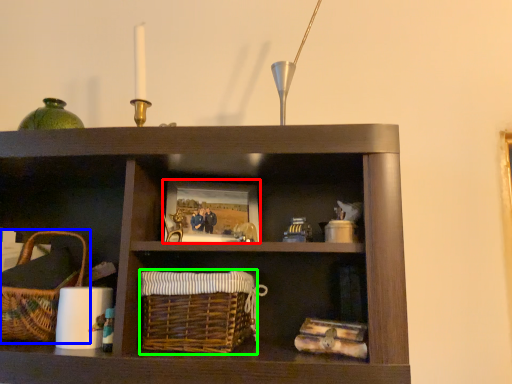
Question: Which is nearer to the picture frame (highlighted by a red box)? picnic basket (highlighted by a blue box) or basket (highlighted by a green box).

Choices:
 (A) picnic basket
 (B) basket

Answer: (B)